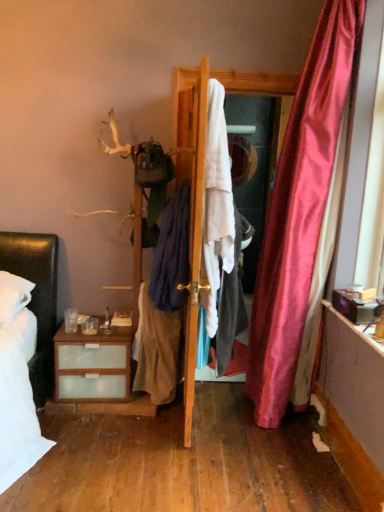
Question: Considering the positions of dark blue fabric at center, the second clothing positioned from the right, and white fabric at center in the image, is dark blue fabric at center, the second clothing positioned from the right, bigger or smaller than white fabric at center?

Choices:
 (A) small
 (B) big

Answer: (A)

Question: Does point (185, 284) appear closer or farther from the camera than point (193, 393)?

Choices:
 (A) closer
 (B) farther

Answer: (A)

Question: Which object is positioned farthest from the white fabric at center?

Choices:
 (A) dark blue fabric at center, the second clothing positioned from the right
 (B) light brown fabric skirt at center, which ranks as the first clothing in left-to-right order
 (C) wooden door at center
 (D) matte white mirror at center
 (E) white cotton shirt at center, marked as the first clothing in a right-to-left arrangement

Answer: (D)

Question: Estimate the real-world distances between objects in this image. Which object is farther from the light brown fabric skirt at center, which ranks as the first clothing in left-to-right order?

Choices:
 (A) white cotton shirt at center, marked as the first clothing in a right-to-left arrangement
 (B) wooden door at center
 (C) matte white mirror at center
 (D) dark blue fabric at center, the second clothing positioned from the right
 (E) white fabric at center

Answer: (C)